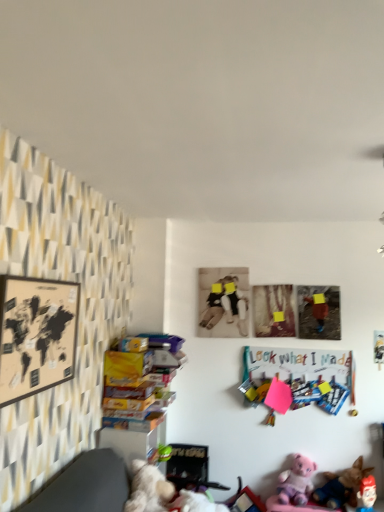
Question: From the image's perspective, is soft plush dog at lower right, the second toy viewed from the right, positioned above or below sepia-toned photo at center, placed as the second picture frame when sorted from right to left?

Choices:
 (A) below
 (B) above

Answer: (A)

Question: Do you think soft plush dog at lower right, the second toy viewed from the right, is within sepia-toned photo at center, arranged as the 2th picture frame when viewed from the left, or outside of it?

Choices:
 (A) outside
 (B) inside

Answer: (A)

Question: Considering the real-world distances, which object is closest to the soft plush dog at lower right, the second toy viewed from the right?

Choices:
 (A) sepia-toned photo at center, arranged as the 2th picture frame when viewed from the left
 (B) wooden map at left, which ranks as the first picture frame in front-to-back order
 (C) colorful paperboard at center right
 (D) fluffy white teddy bear at lower center, the 1th toy when ordered from left to right
 (E) plush pink bear at lower right, which ranks as the 2th toy in front-to-back order

Answer: (E)

Question: Considering the real-world distances, which object is closest to the pink plush bear at lower right, which appears as the fourth toy when viewed from the front?

Choices:
 (A) colorful paperboard at center right
 (B) soft plush dog at lower right, which appears as the third toy when viewed from the left
 (C) wooden map at left, which ranks as the first picture frame in front-to-back order
 (D) plush pink bear at lower right, marked as the 3th toy in a back-to-front arrangement
 (E) fluffy white teddy bear at lower center, the 1th toy when ordered from left to right

Answer: (B)